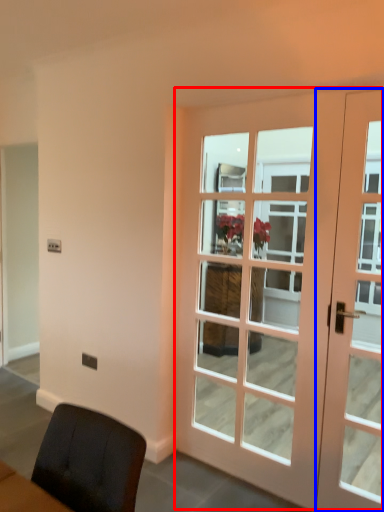
Question: Which of the following is the closest to the observer, door (highlighted by a red box) or door (highlighted by a blue box)?

Choices:
 (A) door
 (B) door

Answer: (A)